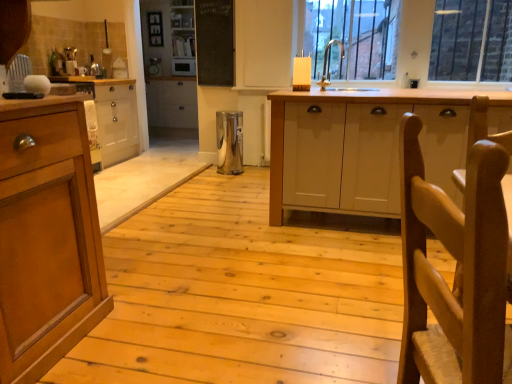
The height and width of the screenshot is (384, 512). What do you see at coordinates (112, 115) in the screenshot? I see `wooden cabinet at left, the first cabinetry in the left-to-right sequence` at bounding box center [112, 115].

Find the location of a particular element. This screenshot has width=512, height=384. white matte cabinet at center, which is the second cabinetry from back to front is located at coordinates (366, 146).

Where is `metallic trash can at center, which is the second appliance in top-to-bottom order`? This screenshot has height=384, width=512. metallic trash can at center, which is the second appliance in top-to-bottom order is located at coordinates point(229,142).

You are a GUI agent. You are given a task and a screenshot of the screen. Output one action in this format:
    pyautogui.click(x=<x>, y=<y>)
    Task: Click on the white glossy cabinet at upper center
    The width and height of the screenshot is (512, 384).
    Given the screenshot: What is the action you would take?
    pyautogui.click(x=167, y=77)

The height and width of the screenshot is (384, 512). Find the location of `silver metallic sink at upper center`. silver metallic sink at upper center is located at coordinates click(x=326, y=64).

What is the approximate height of wooden woven chair at right?

It is 30.82 inches.

The width and height of the screenshot is (512, 384). Identify the location of wooden cabinet at left, which is the first cabinetry in back-to-front order. (112, 115).

From the picture: Between wooden cabinet at left, the 2th cabinetry from the front, and satin silver microwave at center, placed as the 1th appliance when sorted from back to front, which one is positioned in front?

wooden cabinet at left, the 2th cabinetry from the front.

Who is taller, wooden cabinet at left, the 2th cabinetry from the front, or satin silver microwave at center, marked as the second appliance in a right-to-left arrangement?

wooden cabinet at left, the 2th cabinetry from the front.

In the scene shown: From the image's perspective, is wooden cabinet at left, marked as the 2th cabinetry in a right-to-left arrangement, below satin silver microwave at center, which appears as the second appliance when ordered from the bottom?

Yes.

From a real-world perspective, is wooden cabinet at left, marked as the 2th cabinetry in a right-to-left arrangement, on satin silver microwave at center, which appears as the second appliance when ordered from the bottom?

No, from a real-world perspective, wooden cabinet at left, marked as the 2th cabinetry in a right-to-left arrangement, is not over satin silver microwave at center, which appears as the second appliance when ordered from the bottom

Which is behind, point (152, 37) or point (366, 156)?

The point (152, 37) is farther from the camera.

Does white glossy cabinet at upper center have a greater width compared to white matte cabinet at center, the first cabinetry from the front?

No.

Is white glossy cabinet at upper center inside or outside of white matte cabinet at center, which is the second cabinetry from back to front?

The correct answer is: outside.

Is white glossy cabinet at upper center not near white matte cabinet at center, the first cabinetry from the front?

white glossy cabinet at upper center is far away from white matte cabinet at center, the first cabinetry from the front.

There is a metallic trash can at center, the 1th appliance viewed from the right. Where is `the 2nd cabinetry above it (from a real-world perspective)`? This screenshot has width=512, height=384. the 2nd cabinetry above it (from a real-world perspective) is located at coordinates (112, 115).

In the scene shown: Is metallic trash can at center, the 1th appliance viewed from the right, not near wooden cabinet at left, marked as the 2th cabinetry in a right-to-left arrangement?

Absolutely, metallic trash can at center, the 1th appliance viewed from the right, is distant from wooden cabinet at left, marked as the 2th cabinetry in a right-to-left arrangement.

Is point (229, 125) in front of point (129, 85)?

Yes, point (229, 125) is in front of point (129, 85).

From a real-world perspective, who is located higher, metallic trash can at center, which is the second appliance in top-to-bottom order, or wooden cabinet at left, the first cabinetry in the left-to-right sequence?

wooden cabinet at left, the first cabinetry in the left-to-right sequence, from a real-world perspective.

Between wooden cabinet at left, the first cabinetry in the left-to-right sequence, and white matte cabinet at center, marked as the 2th cabinetry in a left-to-right arrangement, which one has smaller size?

wooden cabinet at left, the first cabinetry in the left-to-right sequence.

From the picture: Is wooden cabinet at left, which is the first cabinetry in back-to-front order, facing towards white matte cabinet at center, which is the second cabinetry from back to front?

Yes, wooden cabinet at left, which is the first cabinetry in back-to-front order, is aimed at white matte cabinet at center, which is the second cabinetry from back to front.

Can you confirm if wooden cabinet at left, marked as the 2th cabinetry in a right-to-left arrangement, is thinner than white matte cabinet at center, which is the second cabinetry from back to front?

Indeed, wooden cabinet at left, marked as the 2th cabinetry in a right-to-left arrangement, has a lesser width compared to white matte cabinet at center, which is the second cabinetry from back to front.

From the image's perspective, which is below, silver metallic sink at upper center or satin silver microwave at center, placed as the 1th appliance when sorted from back to front?

silver metallic sink at upper center, from the image's perspective.

Which object is more forward, silver metallic sink at upper center or satin silver microwave at center, which appears as the second appliance when ordered from the bottom?

silver metallic sink at upper center.

Is silver metallic sink at upper center far from satin silver microwave at center, marked as the 2th appliance in a front-to-back arrangement?

Absolutely, silver metallic sink at upper center is distant from satin silver microwave at center, marked as the 2th appliance in a front-to-back arrangement.

Considering the sizes of silver metallic sink at upper center and satin silver microwave at center, marked as the 2th appliance in a front-to-back arrangement, in the image, is silver metallic sink at upper center bigger or smaller than satin silver microwave at center, marked as the 2th appliance in a front-to-back arrangement,?

Considering their sizes, silver metallic sink at upper center takes up less space than satin silver microwave at center, marked as the 2th appliance in a front-to-back arrangement.

Which object is more forward, wooden woven chair at right or silver metallic sink at upper center?

wooden woven chair at right is closer to the camera.

Which of these two, wooden woven chair at right or silver metallic sink at upper center, is thinner?

Thinner between the two is silver metallic sink at upper center.

How many degrees apart are the facing directions of wooden woven chair at right and silver metallic sink at upper center?

The angular difference between wooden woven chair at right and silver metallic sink at upper center is 29.4 degrees.

Where is `chair that is under the silver metallic sink at upper center (from a real-world perspective)`? chair that is under the silver metallic sink at upper center (from a real-world perspective) is located at coordinates (459, 270).

Locate an element on the screen. The height and width of the screenshot is (384, 512). bulletin board lying on the left of metallic trash can at center, which is the second appliance in top-to-bottom order is located at coordinates (214, 42).

Considering the relative sizes of metallic trash can at center, which is the second appliance in top-to-bottom order, and black chalkboard at upper center in the image provided, is metallic trash can at center, which is the second appliance in top-to-bottom order, taller than black chalkboard at upper center?

In fact, metallic trash can at center, which is the second appliance in top-to-bottom order, may be shorter than black chalkboard at upper center.

From a real-world perspective, which is physically below, metallic trash can at center, the 1th appliance viewed from the right, or black chalkboard at upper center?

metallic trash can at center, the 1th appliance viewed from the right, is physically lower.

Is metallic trash can at center, the 1th appliance viewed from the right, bigger than black chalkboard at upper center?

Correct, metallic trash can at center, the 1th appliance viewed from the right, is larger in size than black chalkboard at upper center.

Locate an element on the screen. The height and width of the screenshot is (384, 512). appliance above the wooden cabinet at left, the first cabinetry in the left-to-right sequence (from the image's perspective) is located at coordinates (184, 66).

At what (x,y) coordinates should I click in order to perform the action: click on cabinetry that appears on the right of white glossy cabinet at upper center. Please return your answer as a coordinate pair (x, y). This screenshot has width=512, height=384. Looking at the image, I should click on pos(366,146).

Looking at this image, from the image, which object appears to be farther from metallic trash can at center, marked as the 2th appliance in a left-to-right arrangement, satin silver microwave at center, which appears as the second appliance when ordered from the bottom, or black chalkboard at upper center?

Among the two, satin silver microwave at center, which appears as the second appliance when ordered from the bottom, is located further to metallic trash can at center, marked as the 2th appliance in a left-to-right arrangement.

Based on the photo, which object lies nearer to the anchor point wooden woven chair at right, satin silver microwave at center, which ranks as the 1th appliance in left-to-right order, or wooden cabinet at left, which is the first cabinetry in back-to-front order?

The object closer to wooden woven chair at right is wooden cabinet at left, which is the first cabinetry in back-to-front order.

Looking at this image, considering their positions, is black chalkboard at upper center positioned closer to wooden cabinet at left, which is the first cabinetry in back-to-front order, than white matte cabinet at center, which is the 1th cabinetry from right to left?

The object closer to wooden cabinet at left, which is the first cabinetry in back-to-front order, is black chalkboard at upper center.

From the image, which object appears to be farther from wooden woven chair at right, wooden cabinet at left, marked as the 2th cabinetry in a right-to-left arrangement, or satin silver microwave at center, which appears as the second appliance when ordered from the bottom?

satin silver microwave at center, which appears as the second appliance when ordered from the bottom, is positioned further to the anchor wooden woven chair at right.

Estimate the real-world distances between objects in this image. Which object is further from silver metallic sink at upper center, metallic trash can at center, marked as the 2th appliance in a left-to-right arrangement, or white matte cabinet at center, marked as the 2th cabinetry in a left-to-right arrangement?

The object further to silver metallic sink at upper center is white matte cabinet at center, marked as the 2th cabinetry in a left-to-right arrangement.

Looking at this image, which object lies nearer to the anchor point white matte cabinet at center, marked as the 2th cabinetry in a left-to-right arrangement, white glossy cabinet at upper center or wooden cabinet at left, the 2th cabinetry from the front?

Among the two, wooden cabinet at left, the 2th cabinetry from the front, is located nearer to white matte cabinet at center, marked as the 2th cabinetry in a left-to-right arrangement.

Which object lies further to the anchor point wooden cabinet at left, marked as the 2th cabinetry in a right-to-left arrangement, wooden woven chair at right or white glossy cabinet at upper center?

wooden woven chair at right is positioned further to the anchor wooden cabinet at left, marked as the 2th cabinetry in a right-to-left arrangement.

Which object lies further to the anchor point white glossy cabinet at upper center, metallic trash can at center, marked as the 2th appliance in a left-to-right arrangement, or wooden cabinet at left, which is the first cabinetry in back-to-front order?

The object further to white glossy cabinet at upper center is metallic trash can at center, marked as the 2th appliance in a left-to-right arrangement.

Identify the location of cabinetry positioned between wooden woven chair at right and wooden cabinet at left, the first cabinetry in the left-to-right sequence, from near to far. (366, 146).

Locate an element on the screen. cabinetry between wooden woven chair at right and silver metallic sink at upper center along the z-axis is located at coordinates tap(366, 146).

The height and width of the screenshot is (384, 512). What are the coordinates of `appliance between wooden woven chair at right and satin silver microwave at center, marked as the 2th appliance in a front-to-back arrangement, in the front-back direction` in the screenshot? It's located at (229, 142).

Where is `bulletin board between wooden cabinet at left, the first cabinetry in the left-to-right sequence, and white matte cabinet at center, the first cabinetry from the front`? The height and width of the screenshot is (384, 512). bulletin board between wooden cabinet at left, the first cabinetry in the left-to-right sequence, and white matte cabinet at center, the first cabinetry from the front is located at coordinates (214, 42).